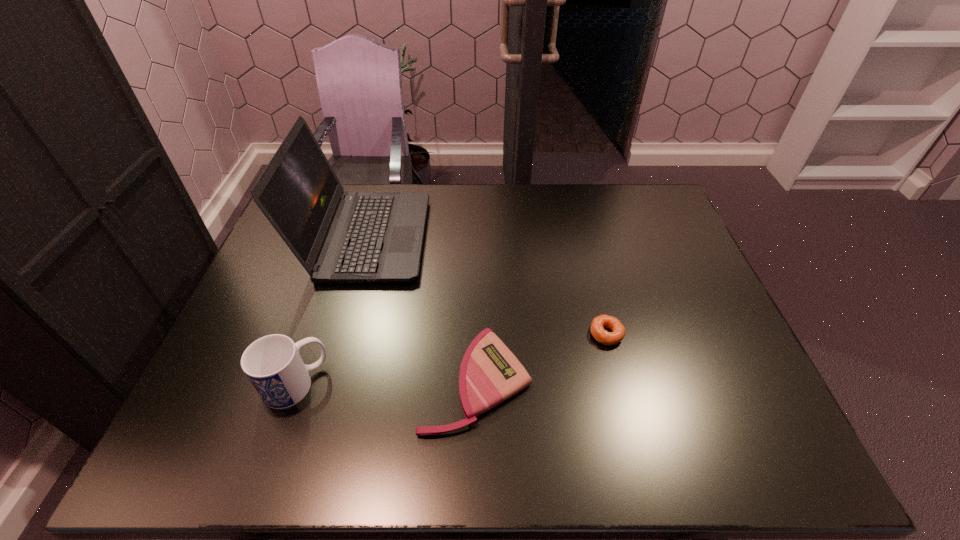
Locate an element on the screen. Image resolution: width=960 pixels, height=540 pixels. free space between the farthest object and the doughnut is located at coordinates (487, 286).

Identify the location of free space between the second tallest object and the wristlet. The image size is (960, 540). (386, 382).

Where is `vacant space that's between the doughnut and the wristlet`? This screenshot has height=540, width=960. vacant space that's between the doughnut and the wristlet is located at coordinates (541, 357).

The image size is (960, 540). What are the coordinates of `free space between the doughnut and the laptop_computer` in the screenshot? It's located at (487, 286).

You are a GUI agent. You are given a task and a screenshot of the screen. Output one action in this format:
    pyautogui.click(x=<x>, y=<y>)
    Task: Click on the vacant area between the tallest object and the second tallest object
    The width and height of the screenshot is (960, 540).
    Given the screenshot: What is the action you would take?
    (x=331, y=310)

The image size is (960, 540). In order to click on vacant point located between the farthest object and the mug in this screenshot , I will do pos(331,310).

Where is `empty space that is in between the farthest object and the second object from right to left`? empty space that is in between the farthest object and the second object from right to left is located at coordinates point(421,309).

Identify the location of free spot between the rightmost object and the second tallest object. This screenshot has height=540, width=960. (451, 359).

Find the location of a particular element. The image size is (960, 540). unoccupied area between the mug and the doughnut is located at coordinates (451, 359).

You are a GUI agent. You are given a task and a screenshot of the screen. Output one action in this format:
    pyautogui.click(x=<x>, y=<y>)
    Task: Click on the empty space that is in between the mug and the farthest object
    This screenshot has height=540, width=960.
    Given the screenshot: What is the action you would take?
    pyautogui.click(x=331, y=310)